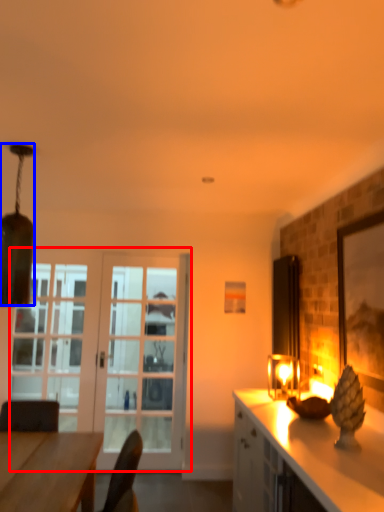
Question: Which point is further to the camera, door (highlighted by a red box) or lamp (highlighted by a blue box)?

Choices:
 (A) door
 (B) lamp

Answer: (A)